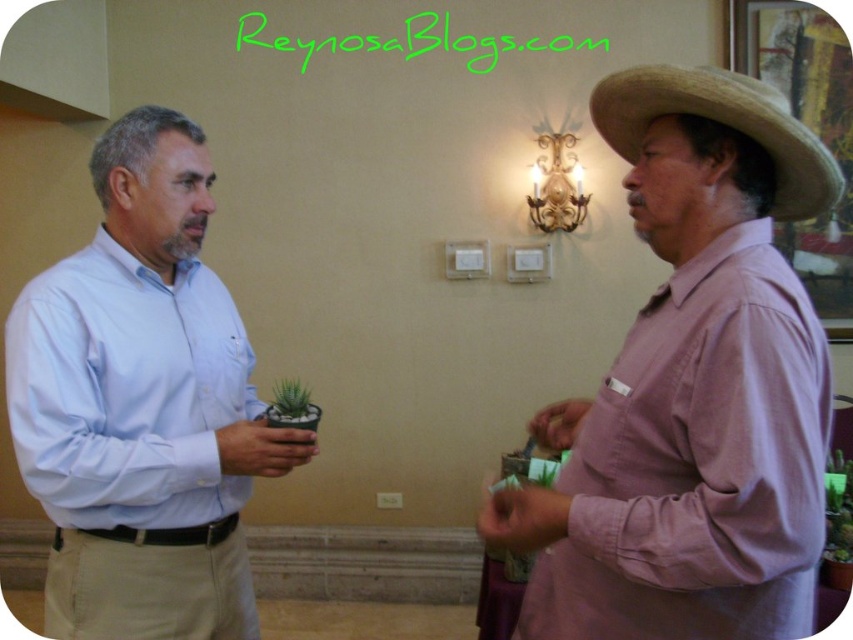
Question: Considering the real-world distances, which object is closest to the light blue shirt at left?

Choices:
 (A) pink cotton shirt at right
 (B) green succulent at center

Answer: (B)

Question: Is pink cotton shirt at right positioned before green succulent at center?

Choices:
 (A) no
 (B) yes

Answer: (B)

Question: Does strawhat at right appear over green succulent at center?

Choices:
 (A) no
 (B) yes

Answer: (B)

Question: Which point is farther to the camera?

Choices:
 (A) light blue shirt at left
 (B) pink cotton shirt at right

Answer: (A)

Question: Among these points, which one is nearest to the camera?

Choices:
 (A) (274, 390)
 (B) (109, 340)
 (C) (804, 166)
 (D) (790, 273)

Answer: (D)

Question: Considering the relative positions of strawhat at right and green succulent at center in the image provided, where is strawhat at right located with respect to green succulent at center?

Choices:
 (A) below
 (B) above

Answer: (B)